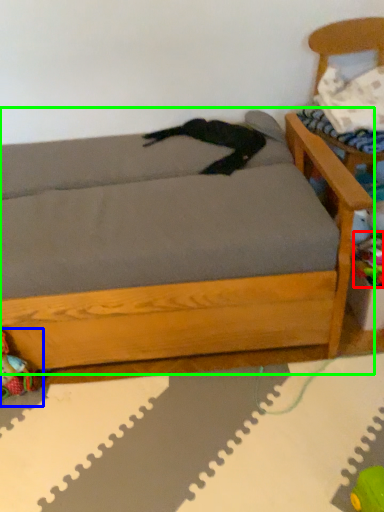
Question: Which object is the farthest from toy (highlighted by a red box)? Choose among these: toy (highlighted by a blue box) or studio couch (highlighted by a green box).

Choices:
 (A) toy
 (B) studio couch

Answer: (A)